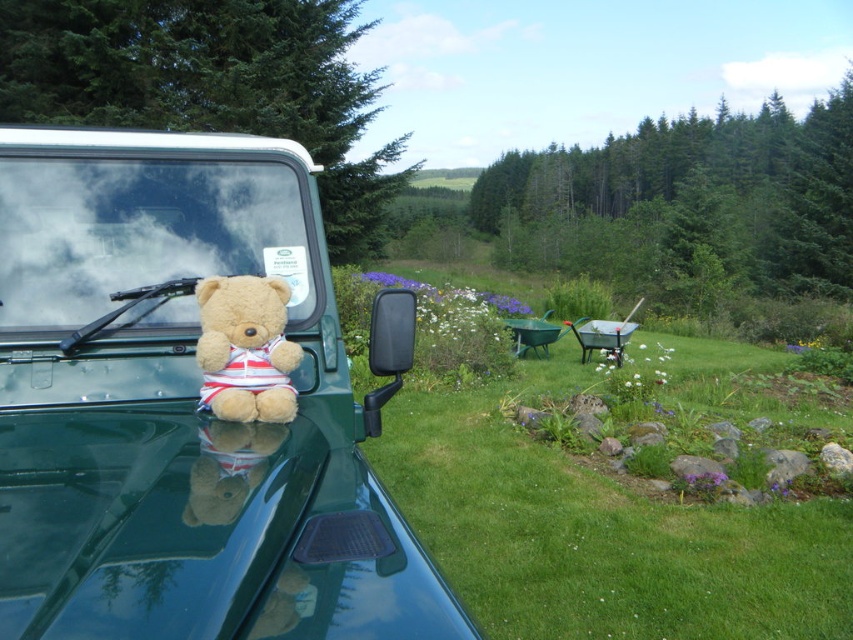
Is transparent glass windshield at upper center closer to camera compared to fuzzy beige teddy bear at center?

No, it is behind fuzzy beige teddy bear at center.

Can you confirm if transparent glass windshield at upper center is smaller than fuzzy beige teddy bear at center?

No, transparent glass windshield at upper center is not smaller than fuzzy beige teddy bear at center.

At what (x,y) coordinates should I click in order to perform the action: click on transparent glass windshield at upper center. Please return your answer as a coordinate pair (x, y). The height and width of the screenshot is (640, 853). Looking at the image, I should click on (143, 232).

Consider the image. Can you confirm if green matte car at center is positioned to the right of transparent glass windshield at upper center?

Yes, green matte car at center is to the right of transparent glass windshield at upper center.

How much distance is there between green matte car at center and transparent glass windshield at upper center?

green matte car at center is 7.72 inches away from transparent glass windshield at upper center.

Does point (352, 472) lie in front of point (167, 241)?

Yes, point (352, 472) is closer to viewer.

Find the location of a particular element. This screenshot has height=640, width=853. green matte car at center is located at coordinates (186, 406).

Can you confirm if green matte car at center is wider than fuzzy beige teddy bear at center?

Yes.

Does green matte car at center have a greater height compared to fuzzy beige teddy bear at center?

Yes.

The width and height of the screenshot is (853, 640). Find the location of `green matte car at center`. green matte car at center is located at coordinates [x=186, y=406].